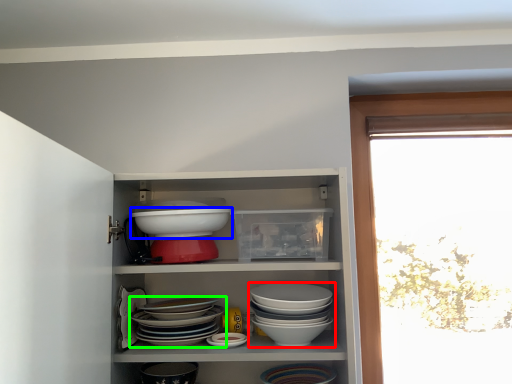
Question: Which object is the closest to the bowl (highlighted by a red box)? Choose among these: bowl (highlighted by a blue box) or bowl (highlighted by a green box).

Choices:
 (A) bowl
 (B) bowl

Answer: (B)